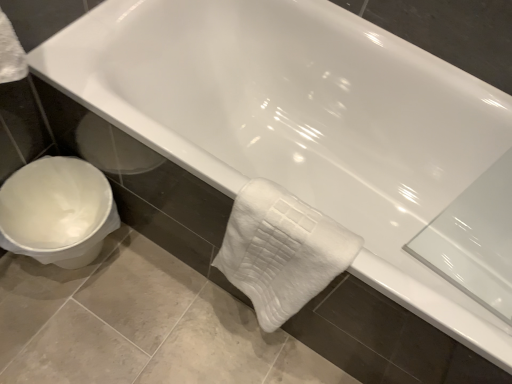
Where is `free space to the right of white plastic toilet at lower left`? This screenshot has width=512, height=384. free space to the right of white plastic toilet at lower left is located at coordinates (142, 292).